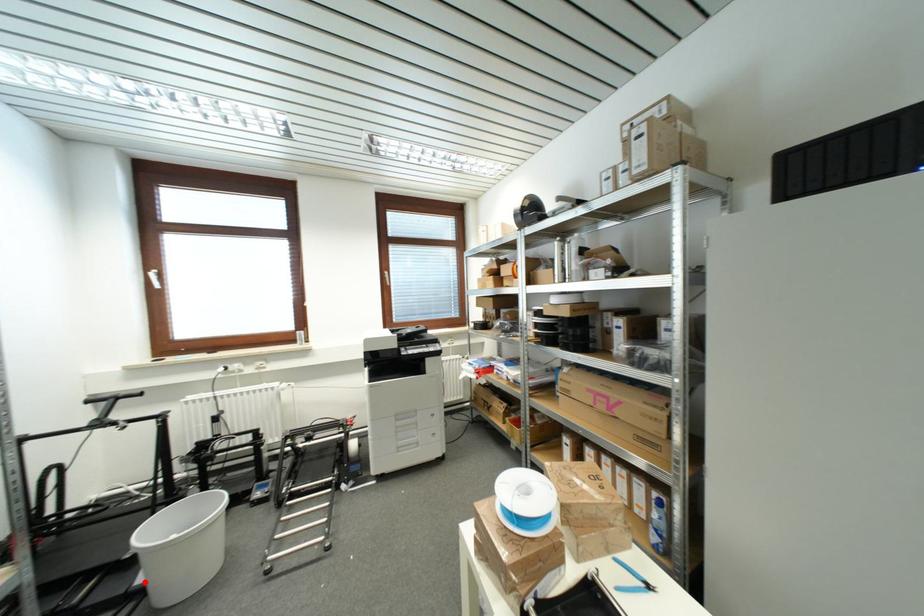
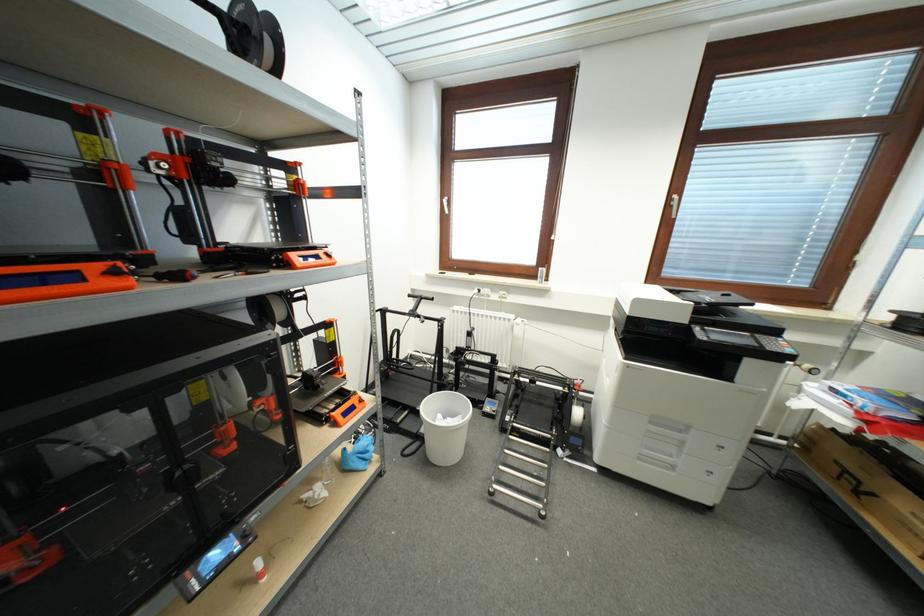
Question: I am providing you with two images of the same scene from different viewpoints. Image1 has a red point marked. In image2, the corresponding 3D location appears at what relative position? Reply with the corresponding letter.

Choices:
 (A) Closer
 (B) Farther

Answer: (B)